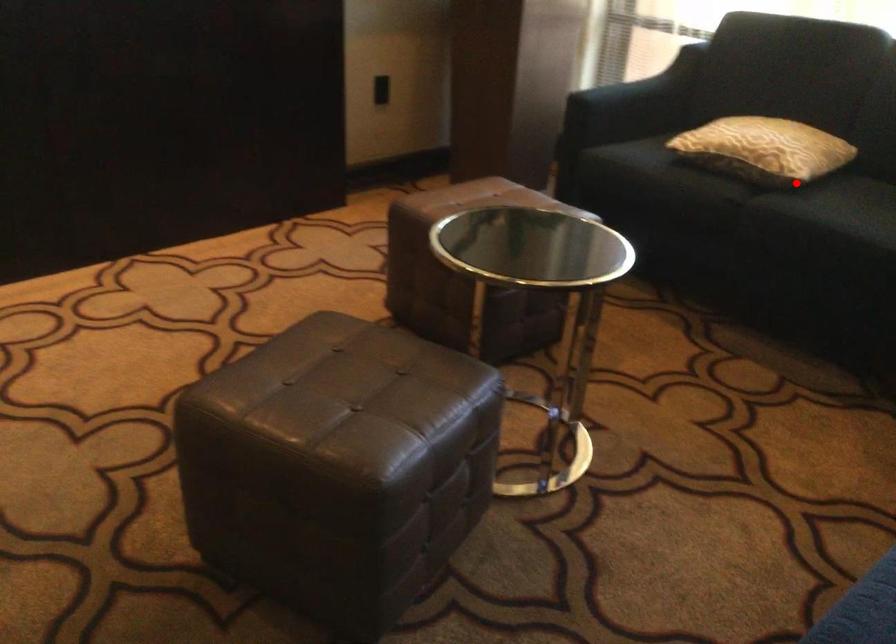
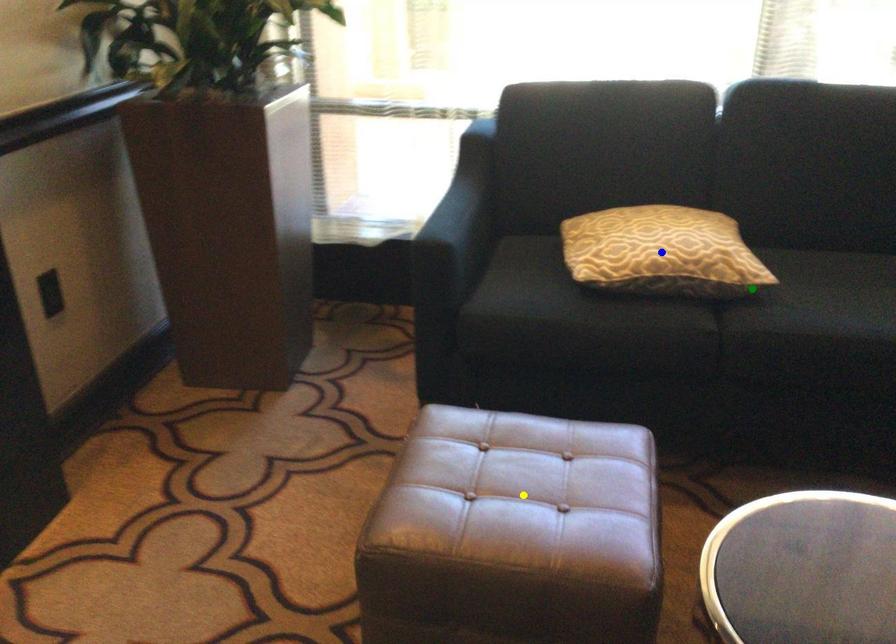
Question: I am providing you with two images of the same scene from different viewpoints. A red point is marked on the first image. You are given multiple points on the second image. Which mark in image 2 goes with the point in image 1?

Choices:
 (A) blue point
 (B) yellow point
 (C) green point

Answer: (C)